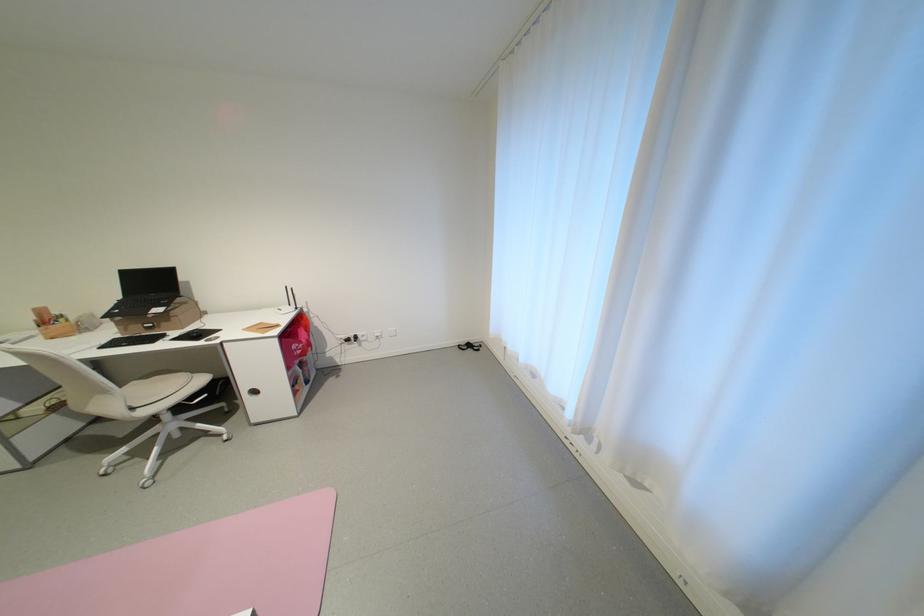
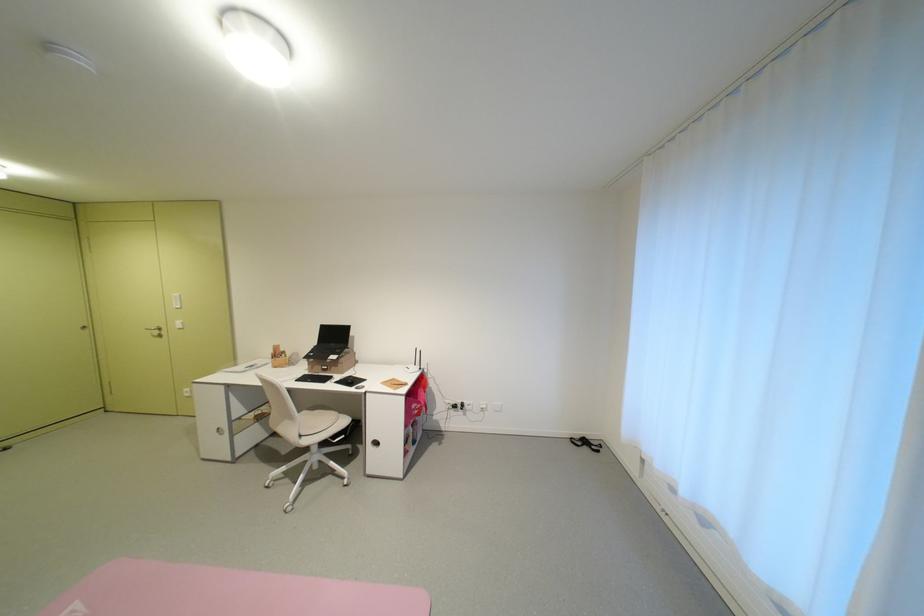
Locate, in the second image, the point that corresponds to pixel 129 299 in the first image.

(324, 345)